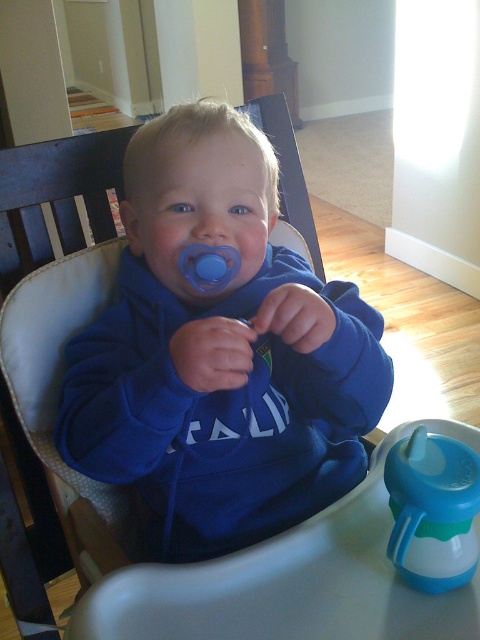
Is blue fleece sweatshirt at center further to the viewer compared to blue rubber sippy cup at lower right?

Yes.

This screenshot has height=640, width=480. What do you see at coordinates (219, 353) in the screenshot? I see `blue fleece sweatshirt at center` at bounding box center [219, 353].

Describe the element at coordinates (219, 353) in the screenshot. I see `blue fleece sweatshirt at center` at that location.

The width and height of the screenshot is (480, 640). I want to click on blue fleece sweatshirt at center, so click(x=219, y=353).